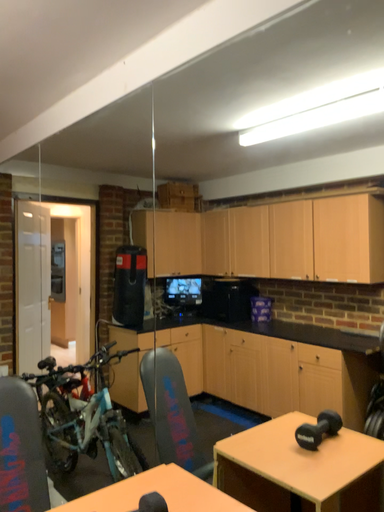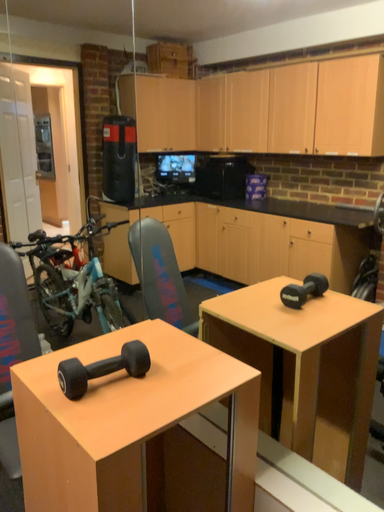
Question: How did the camera likely rotate when shooting the video?

Choices:
 (A) rotated downward
 (B) rotated upward

Answer: (A)